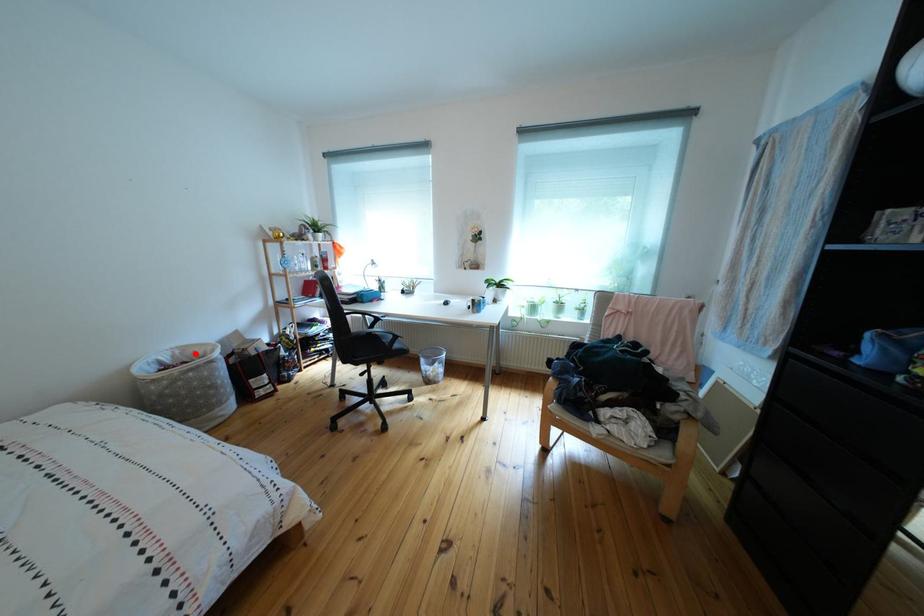
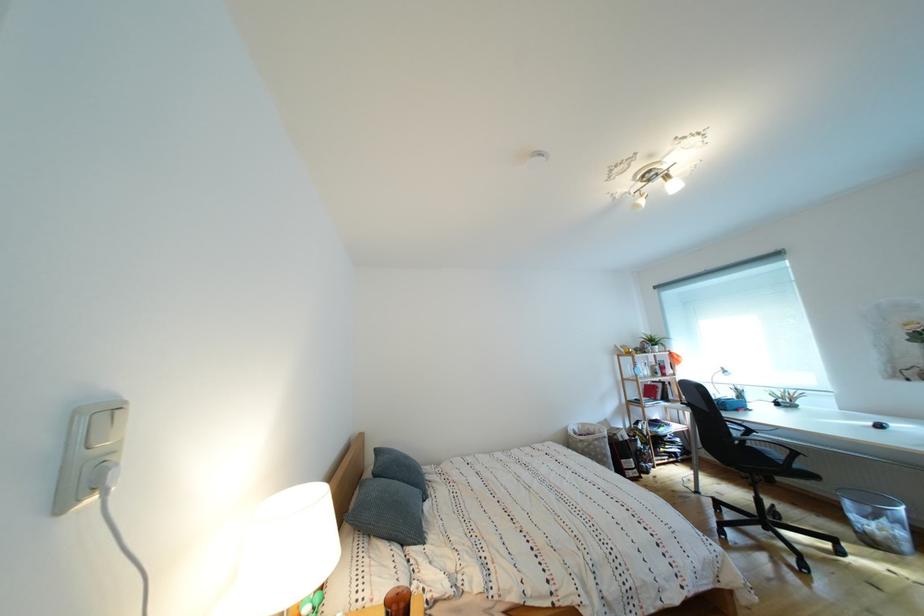
In the second image, find the point that corresponds to the highlighted location in the first image.

(594, 430)